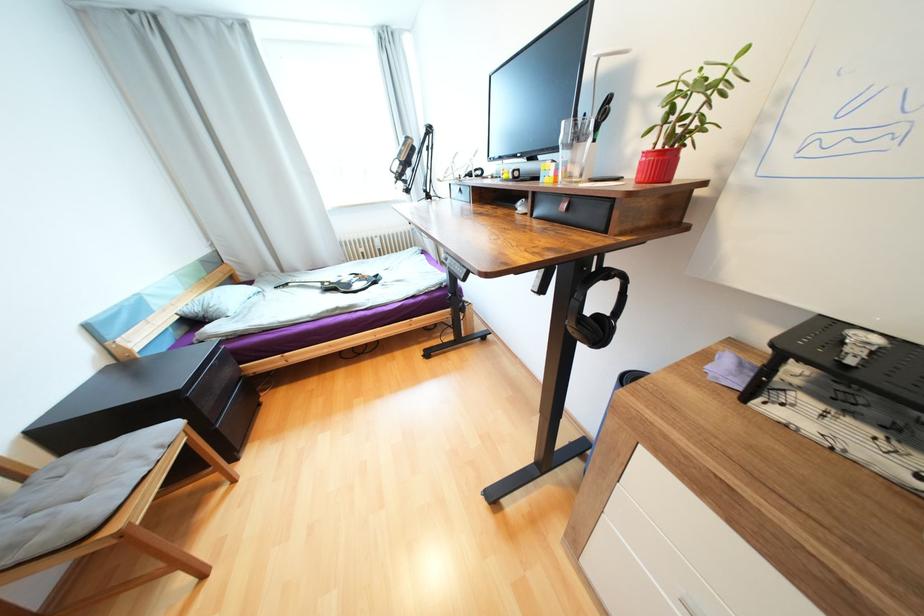
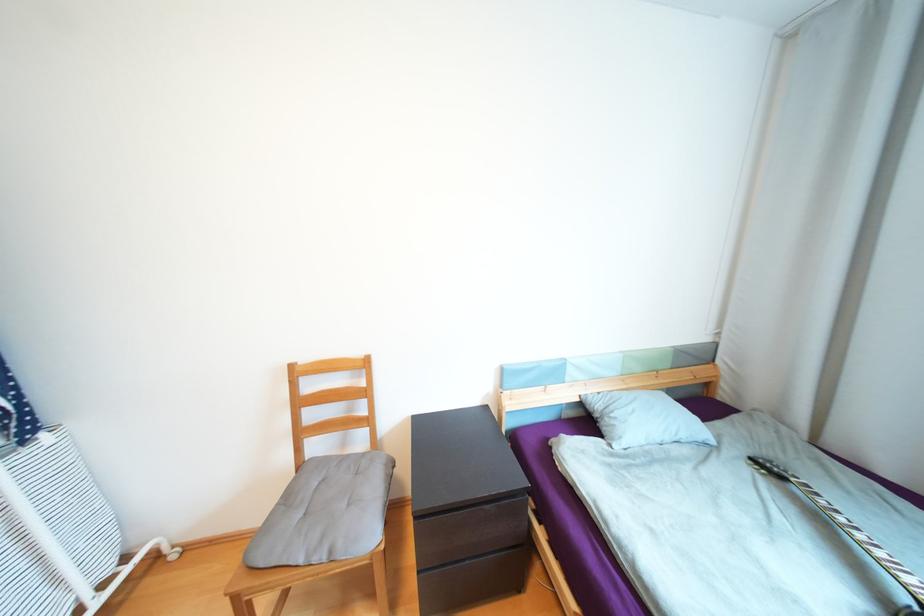
Where in the second image is the point corresponding to point (166, 447) from the first image?

(335, 553)